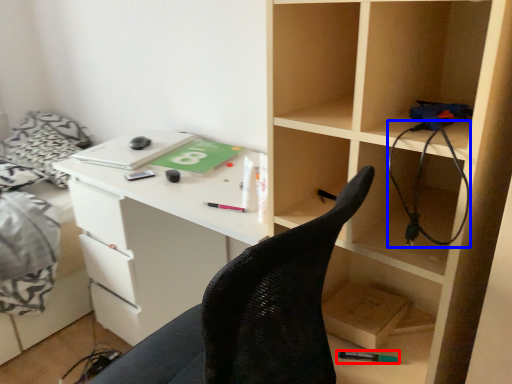
Question: Among these objects, which one is nearest to the camera, stationery (highlighted by a red box) or wire (highlighted by a blue box)?

Choices:
 (A) stationery
 (B) wire

Answer: (B)